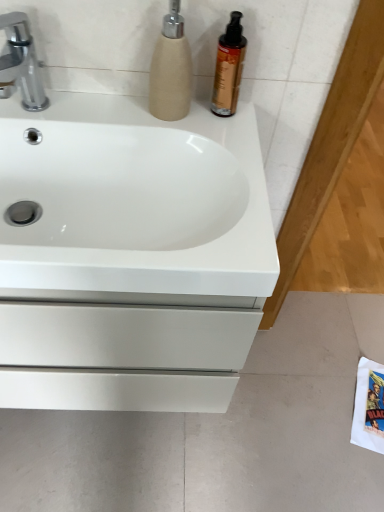
Locate an element on the screen. vacant space that is to the left of shiny amber bottle at upper right is located at coordinates (129, 111).